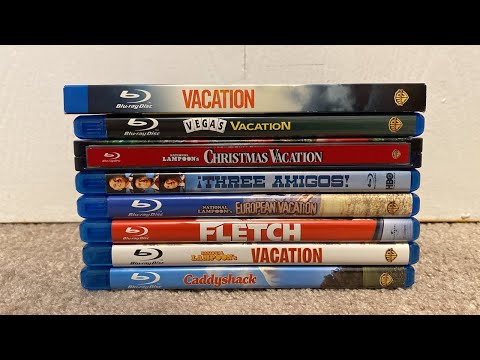
At what (x,y) coordinates should I click in order to perform the action: click on blu ray case. Please return your answer as a coordinate pair (x, y). Image resolution: width=480 pixels, height=360 pixels. Looking at the image, I should click on (171, 279), (156, 258), (161, 233), (161, 212), (154, 184), (151, 162), (151, 134), (152, 98).